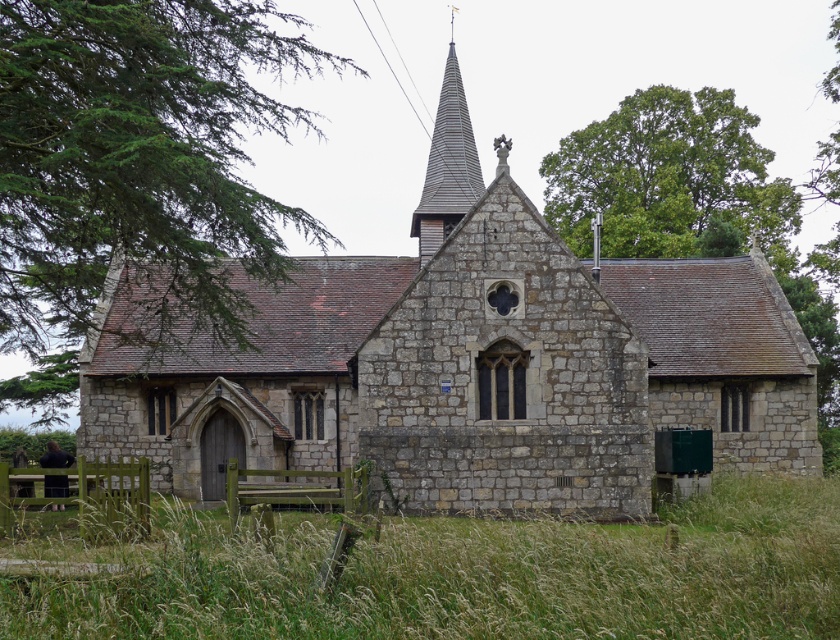
You are a GUI agent. You are given a task and a screenshot of the screen. Output one action in this format:
    pyautogui.click(x=<x>, y=<y>)
    Task: Click on the stone church at center
    The height and width of the screenshot is (640, 840).
    Given the screenshot: What is the action you would take?
    pyautogui.click(x=468, y=362)

Who is more forward, (555, 444) or (458, 120)?

Point (555, 444) is more forward.

I want to click on stone church at center, so click(468, 362).

Is point (770, 278) behind point (558, 154)?

No.

From the picture: How distant is stone church at center from green leafy tree at upper right?

30.92 meters

Between point (623, 403) and point (718, 170), which one is positioned in front?

Point (623, 403)

I want to click on stone church at center, so click(468, 362).

Can you confirm if green grass at lower center is positioned to the right of green leafy tree at upper right?

In fact, green grass at lower center is to the left of green leafy tree at upper right.

Does green grass at lower center have a lesser width compared to green leafy tree at upper right?

No, green grass at lower center is not thinner than green leafy tree at upper right.

Is point (796, 577) in front of point (615, 186)?

That is True.

Where is `green grass at lower center`? This screenshot has width=840, height=640. green grass at lower center is located at coordinates (470, 576).